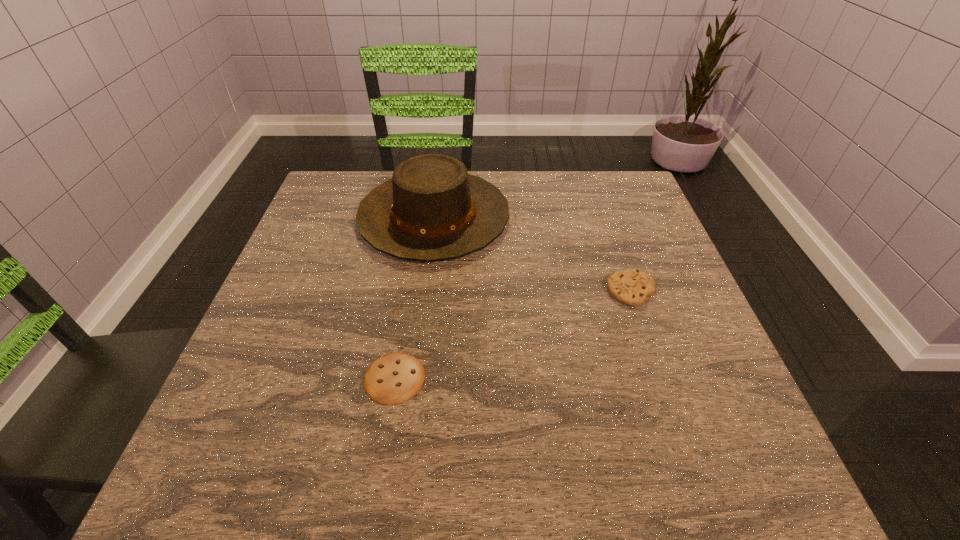
This screenshot has width=960, height=540. I want to click on empty location between the tallest object and the left cookie, so click(x=414, y=298).

Locate an element on the screen. This screenshot has width=960, height=540. empty location between the left cookie and the taller cookie is located at coordinates (513, 334).

Where is `unoccupied area between the tallest object and the left cookie`? The height and width of the screenshot is (540, 960). unoccupied area between the tallest object and the left cookie is located at coordinates (414, 298).

Locate an element on the screen. The image size is (960, 540). free area in between the left cookie and the second shortest object is located at coordinates (513, 334).

This screenshot has height=540, width=960. In order to click on empty space that is in between the nearest object and the farthest object in this screenshot , I will do `click(414, 298)`.

Image resolution: width=960 pixels, height=540 pixels. I want to click on vacant region between the shorter cookie and the tallest object, so click(x=414, y=298).

Where is `free space between the cowboy hat and the shorter cookie`? free space between the cowboy hat and the shorter cookie is located at coordinates (414, 298).

This screenshot has width=960, height=540. What are the coordinates of `free space between the second nearest object and the shortest object` in the screenshot? It's located at (513, 334).

Locate an element on the screen. The height and width of the screenshot is (540, 960). free spot between the second tallest object and the farthest object is located at coordinates (532, 254).

The image size is (960, 540). I want to click on object that ranks as the closest to the rightmost object, so click(x=431, y=209).